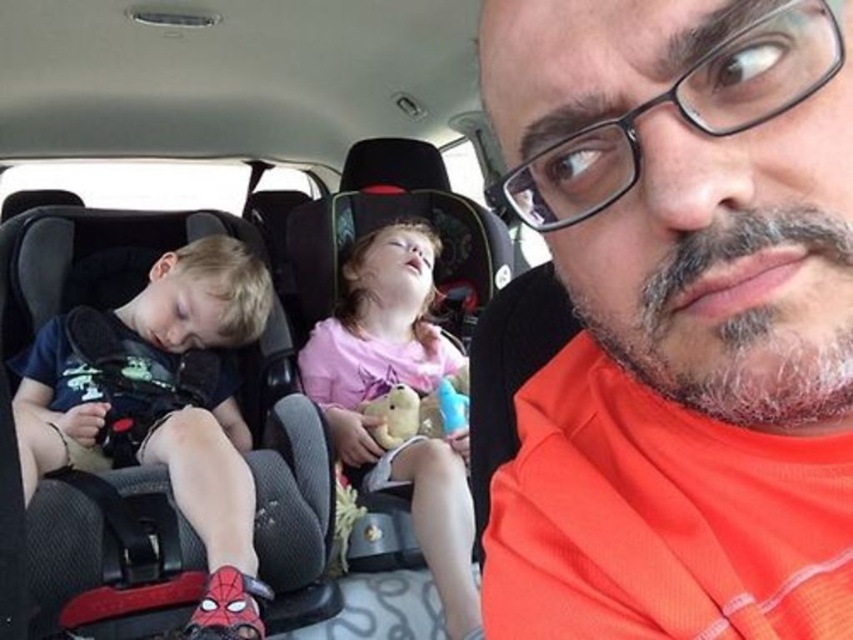
Measure the distance between point (515, 22) and camera.

A distance of 15.93 inches exists between point (515, 22) and camera.

This screenshot has height=640, width=853. Identify the location of orange fabric shirt at upper right. (679, 320).

Based on the photo, does matte black shirt at left appear over pink fabric teddy bear at center?

No, matte black shirt at left is not above pink fabric teddy bear at center.

From the picture: Is matte black shirt at left wider than pink fabric teddy bear at center?

Yes, matte black shirt at left is wider than pink fabric teddy bear at center.

Does point (166, 282) come closer to viewer compared to point (381, 372)?

Yes, it is in front of point (381, 372).

Locate an element on the screen. matte black shirt at left is located at coordinates (161, 406).

The image size is (853, 640). What do you see at coordinates (679, 320) in the screenshot?
I see `orange fabric shirt at upper right` at bounding box center [679, 320].

Is point (733, 410) behind point (352, 296)?

No, it is in front of (352, 296).

The image size is (853, 640). What are the coordinates of `orange fabric shirt at upper right` in the screenshot? It's located at (679, 320).